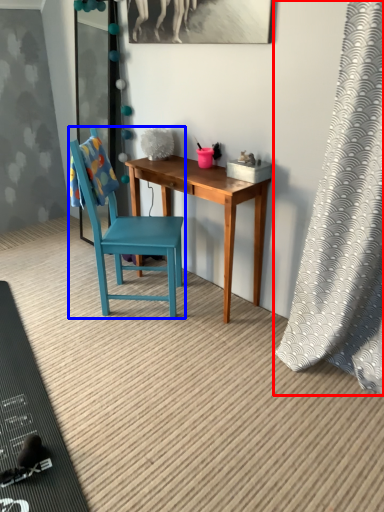
Question: Which of the following is the farthest to the observer, curtain (highlighted by a red box) or chair (highlighted by a blue box)?

Choices:
 (A) curtain
 (B) chair

Answer: (B)